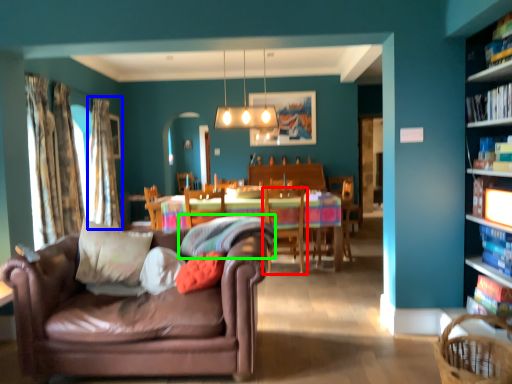
Question: Which is nearer to the chair (highlighted by a red box)? curtain (highlighted by a blue box) or pillow (highlighted by a green box).

Choices:
 (A) curtain
 (B) pillow

Answer: (B)